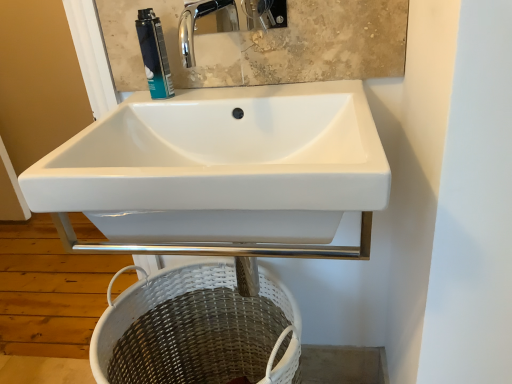
Question: Should I look upward or downward to see white wicker basket at lower center?

Choices:
 (A) down
 (B) up

Answer: (A)

Question: Considering the relative sizes of white glossy sink at center and white wicker basket at lower center in the image provided, is white glossy sink at center taller than white wicker basket at lower center?

Choices:
 (A) yes
 (B) no

Answer: (B)

Question: From a real-world perspective, is white glossy sink at center positioned over white wicker basket at lower center based on gravity?

Choices:
 (A) yes
 (B) no

Answer: (A)

Question: Is white glossy sink at center oriented away from white wicker basket at lower center?

Choices:
 (A) yes
 (B) no

Answer: (B)

Question: Can you confirm if white glossy sink at center is bigger than white wicker basket at lower center?

Choices:
 (A) no
 (B) yes

Answer: (A)

Question: Is the depth of white glossy sink at center less than that of white wicker basket at lower center?

Choices:
 (A) no
 (B) yes

Answer: (B)

Question: Is white glossy sink at center oriented towards white wicker basket at lower center?

Choices:
 (A) no
 (B) yes

Answer: (A)

Question: Is white glossy sink at center to the left of blue metallic can at upper center from the viewer's perspective?

Choices:
 (A) no
 (B) yes

Answer: (A)

Question: Considering the relative sizes of white glossy sink at center and blue metallic can at upper center in the image provided, is white glossy sink at center smaller than blue metallic can at upper center?

Choices:
 (A) yes
 (B) no

Answer: (B)

Question: Is white glossy sink at center touching blue metallic can at upper center?

Choices:
 (A) no
 (B) yes

Answer: (A)

Question: Considering the relative sizes of white glossy sink at center and blue metallic can at upper center in the image provided, is white glossy sink at center shorter than blue metallic can at upper center?

Choices:
 (A) no
 (B) yes

Answer: (A)

Question: Does white glossy sink at center turn towards blue metallic can at upper center?

Choices:
 (A) yes
 (B) no

Answer: (B)

Question: Does white glossy sink at center have a larger size compared to blue metallic can at upper center?

Choices:
 (A) no
 (B) yes

Answer: (B)

Question: Would you consider white wicker basket at lower center to be distant from blue metallic can at upper center?

Choices:
 (A) yes
 (B) no

Answer: (B)